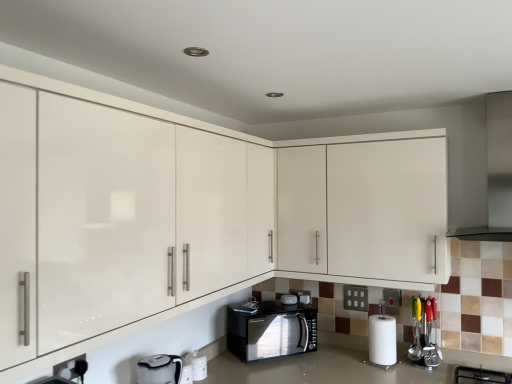
Question: Is white matte paper towel at lower right to the left of matte white cabinets at center, which ranks as the 1th cabinetry in front-to-back order, from the viewer's perspective?

Choices:
 (A) no
 (B) yes

Answer: (A)

Question: From the image's perspective, is white matte paper towel at lower right on matte white cabinets at center, which ranks as the 1th cabinetry in front-to-back order?

Choices:
 (A) no
 (B) yes

Answer: (A)

Question: Is white matte paper towel at lower right wider than matte white cabinets at center, marked as the 2th cabinetry in a back-to-front arrangement?

Choices:
 (A) yes
 (B) no

Answer: (B)

Question: Is white matte paper towel at lower right taller than matte white cabinets at center, marked as the 2th cabinetry in a back-to-front arrangement?

Choices:
 (A) no
 (B) yes

Answer: (A)

Question: From a real-world perspective, is white matte paper towel at lower right beneath matte white cabinets at center, marked as the 2th cabinetry in a back-to-front arrangement?

Choices:
 (A) no
 (B) yes

Answer: (B)

Question: Considering their positions, is white matte paper towel at lower right located in front of or behind satin silver exhaust hood at upper right?

Choices:
 (A) behind
 (B) front

Answer: (A)

Question: In terms of height, does white matte paper towel at lower right look taller or shorter compared to satin silver exhaust hood at upper right?

Choices:
 (A) tall
 (B) short

Answer: (B)

Question: From a real-world perspective, is white matte paper towel at lower right above or below satin silver exhaust hood at upper right?

Choices:
 (A) above
 (B) below

Answer: (B)

Question: Considering the positions of point (382, 347) and point (506, 230), is point (382, 347) closer or farther from the camera than point (506, 230)?

Choices:
 (A) farther
 (B) closer

Answer: (A)

Question: Considering their positions, is matte white cabinets at center, which ranks as the 1th cabinetry in front-to-back order, located in front of or behind black glossy microwave at center, the 3th appliance positioned from the left?

Choices:
 (A) behind
 (B) front

Answer: (B)

Question: Is point (415, 243) closer or farther from the camera than point (304, 294)?

Choices:
 (A) closer
 (B) farther

Answer: (A)

Question: Do you think matte white cabinets at center, marked as the 2th cabinetry in a back-to-front arrangement, is within black glossy microwave at center, the 3th appliance positioned from the left, or outside of it?

Choices:
 (A) outside
 (B) inside

Answer: (A)

Question: Looking at the image, does matte white cabinets at center, marked as the 2th cabinetry in a back-to-front arrangement, seem bigger or smaller compared to black glossy microwave at center, the 3th appliance positioned from the left?

Choices:
 (A) big
 (B) small

Answer: (A)

Question: Is white matte paper towel at lower right spatially inside black glossy microwave at lower center, the 3th appliance from the front, or outside of it?

Choices:
 (A) inside
 (B) outside

Answer: (B)

Question: From the image's perspective, relative to black glossy microwave at lower center, the 3th appliance from the front, is white matte paper towel at lower right above or below?

Choices:
 (A) above
 (B) below

Answer: (B)